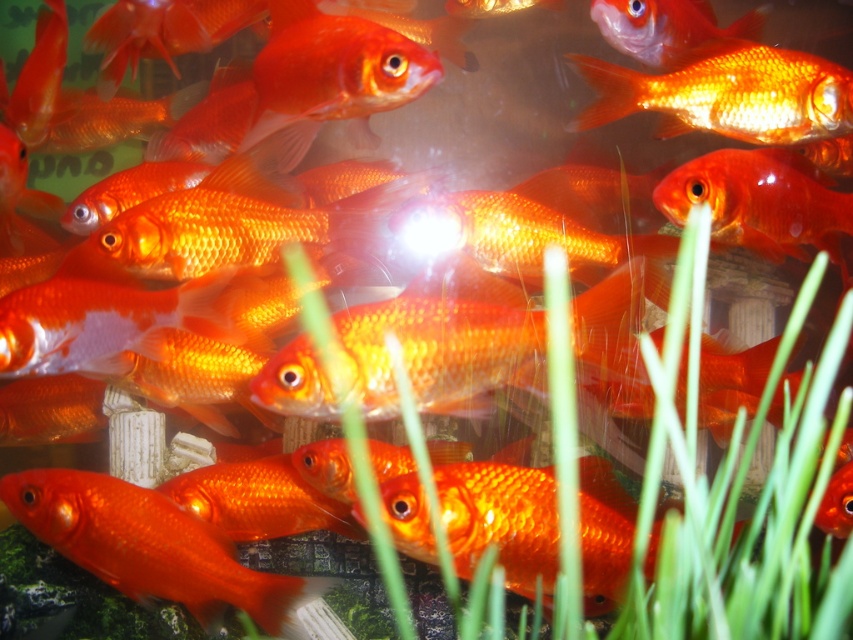
Question: Which point is closer to the camera?

Choices:
 (A) (612, 81)
 (B) (253, 604)

Answer: (B)

Question: Is shiny orange goldfish at center positioned behind shiny orange goldfish at upper right?

Choices:
 (A) yes
 (B) no

Answer: (B)

Question: Which point is farther to the camera?

Choices:
 (A) (715, 104)
 (B) (119, 499)

Answer: (A)

Question: In this image, where is shiny orange goldfish at center located relative to shiny orange goldfish at upper right?

Choices:
 (A) left
 (B) right

Answer: (A)

Question: Is the position of shiny orange goldfish at center more distant than that of shiny orange goldfish at upper right?

Choices:
 (A) yes
 (B) no

Answer: (B)